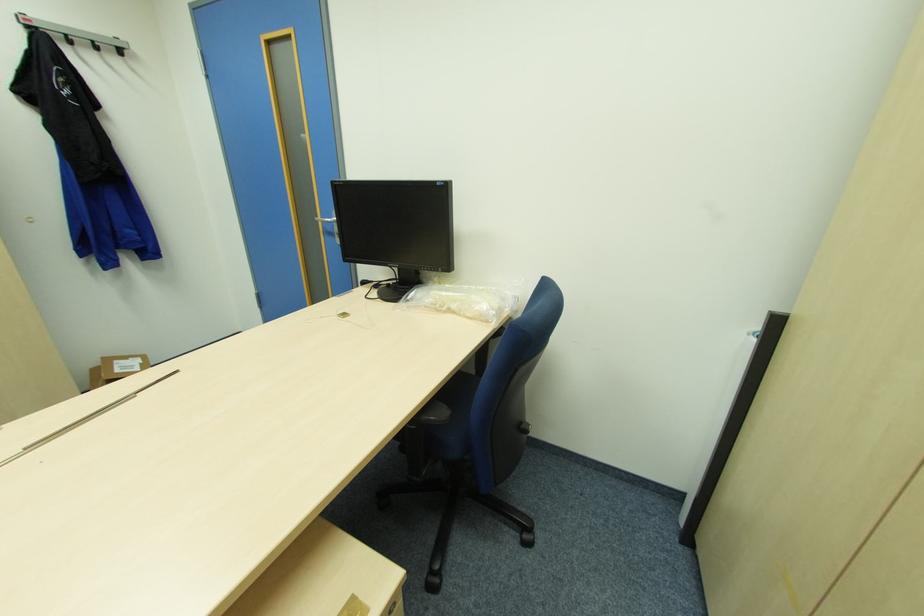
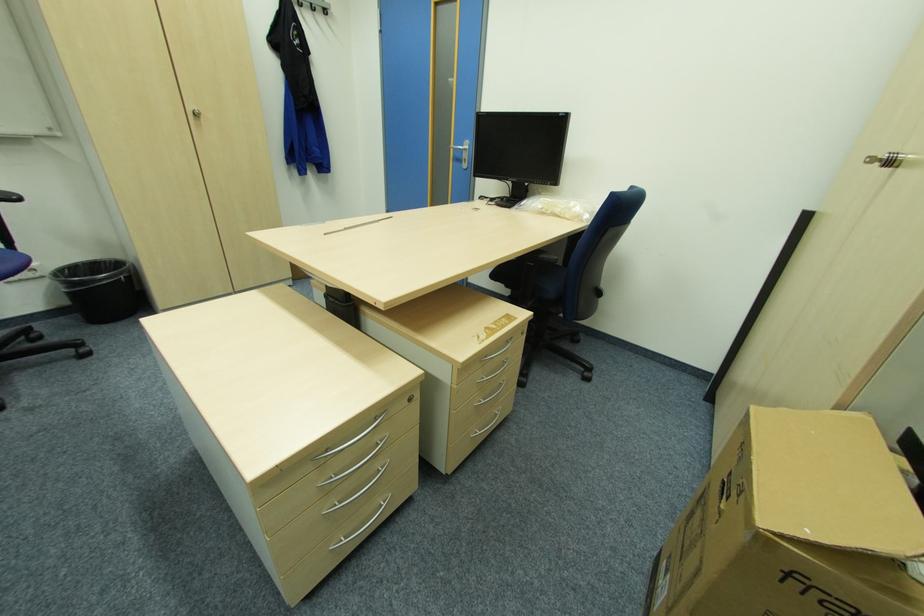
Where in the second image is the point corresponding to point 99,47 from the first image?

(315, 7)